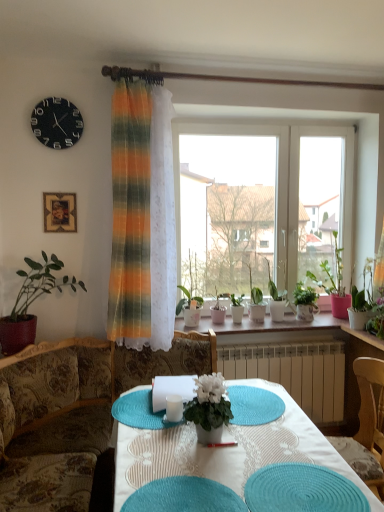
You are a GUI agent. You are given a task and a screenshot of the screen. Output one action in this format:
    pyautogui.click(x=<x>, y=<y>)
    Task: Click on the unoccupied area in front of blue woven placemat at center
    Image resolution: width=384 pixels, height=512 pixels.
    Given the screenshot: What is the action you would take?
    pyautogui.click(x=272, y=448)